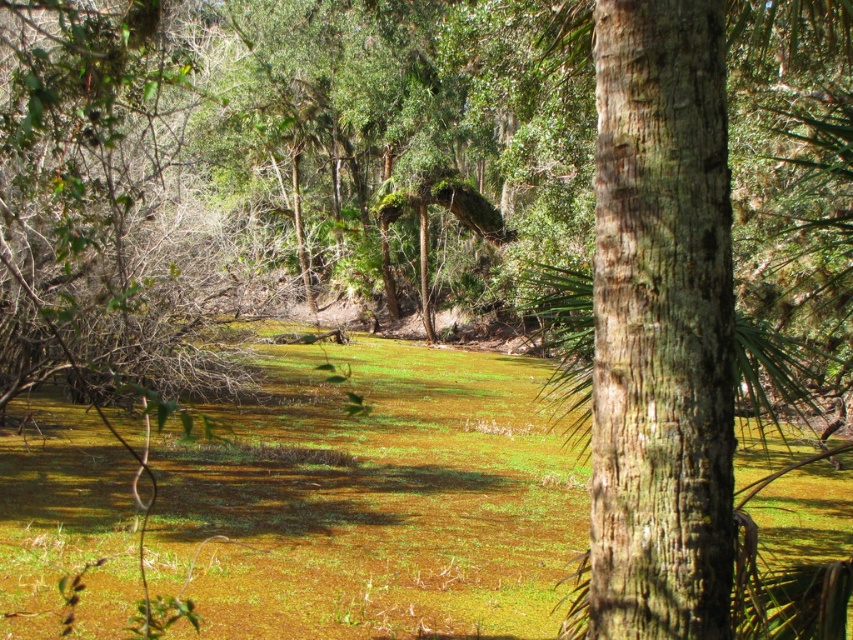
You are standing at the edge of the swamp and want to place a 4 meter long wooden board between the green mossy at center and the tree trunk on the right. Will the board be long enough to span the distance?

The distance between the green mossy at center and the tree trunk on the right is 4.11 meters, so the 4 meter long wooden board will be slightly too short to span the distance.

You are standing at the edge of the swamp and see the point marked at coordinates (373, 500). According to the scene description, what is located at that point?

The point at coordinates (373, 500) marks green mossy at center.